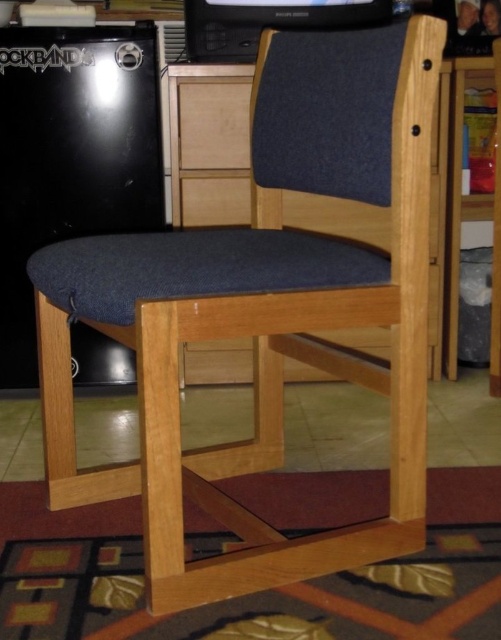
You are taking a photo of the wooden chair and notice two points marked in the image. Which point, point (62, 234) or point (188, 52), is closer to the camera?

Point (62, 234) is closer to the camera than point (188, 52).

You are setting up a small kitchenette area and need to place the black matte mini fridge at left and the black plastic game console at upper center. Which object should you place higher up to ensure proper visibility of both items?

The black matte mini fridge at left is much taller than the black plastic game console at upper center, so you should place the black plastic game console at upper center higher up to ensure it is visible above the fridge.

Looking at this image, you are moving into a small apartment and need to arrange your black matte mini fridge at left and black plastic game console at upper center. Given their widths, which one can you place closer to the wall without blocking the door?

The black matte mini fridge at left has a lesser width compared to the black plastic game console at upper center, so it can be placed closer to the wall without blocking the door since it takes up less space.